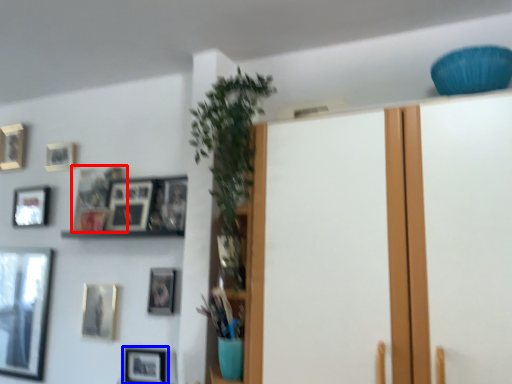
Question: Among these objects, which one is nearest to the camera, picture frame (highlighted by a red box) or picture frame (highlighted by a blue box)?

Choices:
 (A) picture frame
 (B) picture frame

Answer: (B)